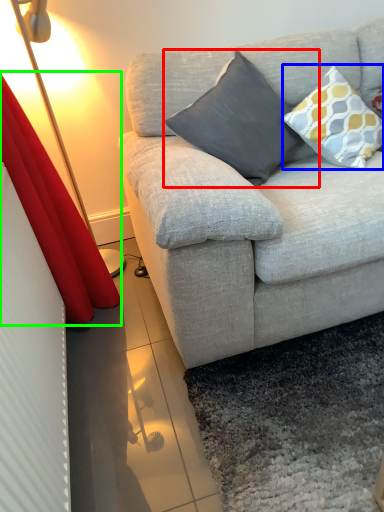
Question: Which object is the farthest from pillow (highlighted by a red box)? Choose among these: pillow (highlighted by a blue box) or curtain (highlighted by a green box).

Choices:
 (A) pillow
 (B) curtain

Answer: (B)